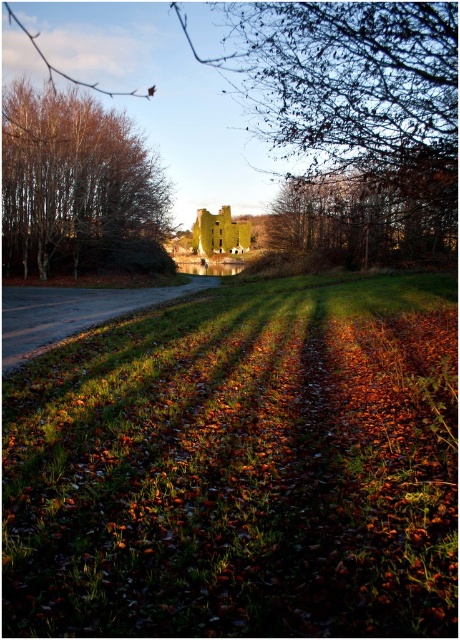
Between green grass at center and green stone building at center, which one has more height?

With more height is green stone building at center.

Does green grass at center have a larger size compared to green stone building at center?

No, green grass at center is not bigger than green stone building at center.

Is point (92, 618) closer to camera compared to point (310, 144)?

Yes, it is.

Locate an element on the screen. Image resolution: width=460 pixels, height=640 pixels. green grass at center is located at coordinates (241, 467).

From the picture: Between green stone building at center and brown leafy tree at left, which one appears on the right side from the viewer's perspective?

green stone building at center is more to the right.

Is point (367, 237) closer to viewer compared to point (150, 225)?

Yes, it is in front of point (150, 225).

Where is `green stone building at center`? green stone building at center is located at coordinates (356, 113).

Which is more to the left, green grass at center or brown leafy tree at left?

brown leafy tree at left is more to the left.

How much distance is there between green grass at center and brown leafy tree at left?

They are 22.64 meters apart.

Who is more distant from viewer, (356, 579) or (87, 196)?

The point (87, 196) is more distant.

The height and width of the screenshot is (640, 460). Find the location of `green grass at center`. green grass at center is located at coordinates (241, 467).